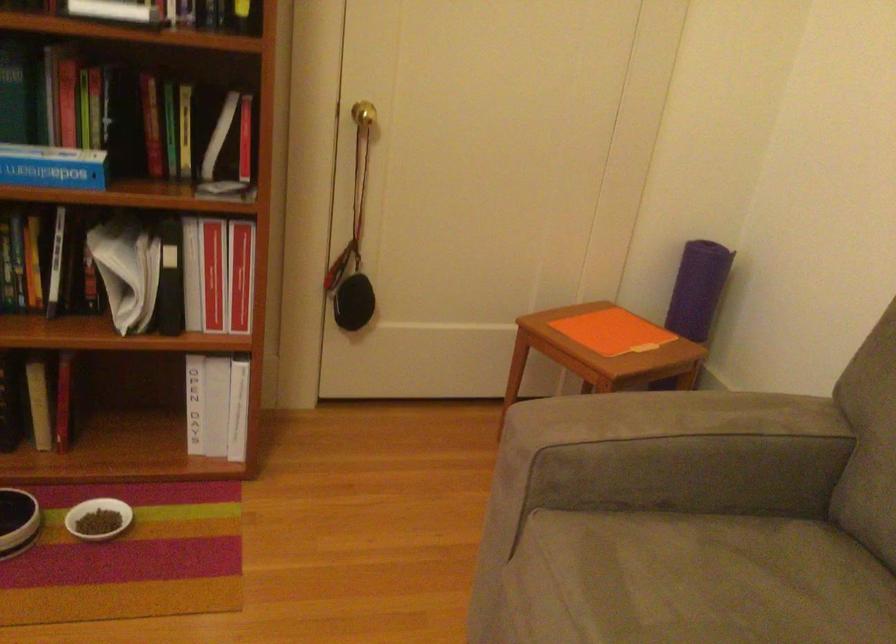
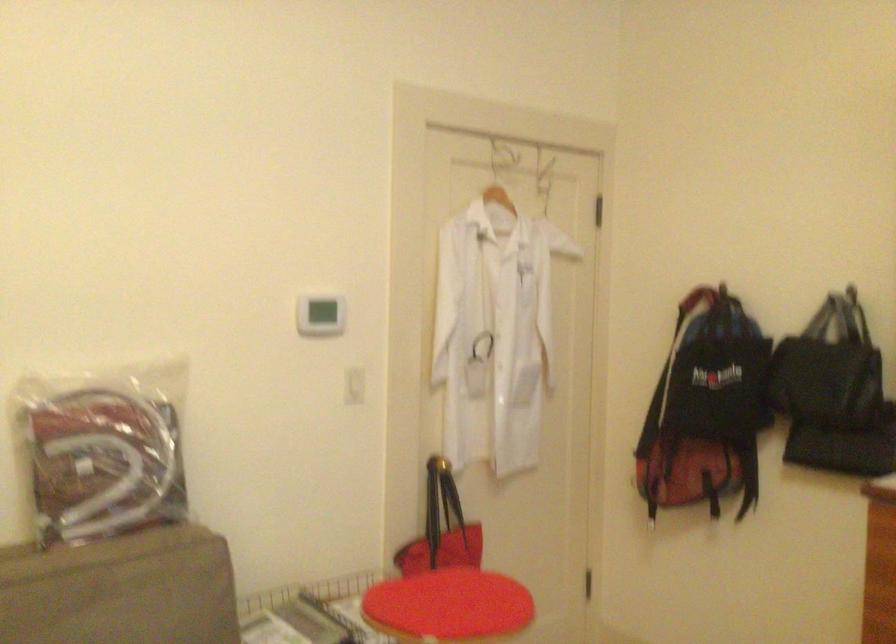
Based on the continuous images, in which direction is the camera rotating?

The rotation direction of the camera is right-down.